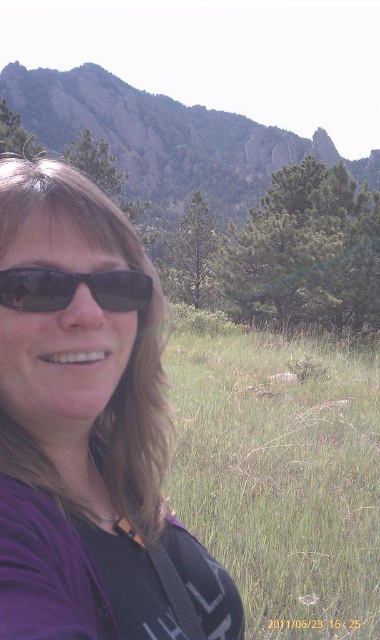
Question: Considering the real-world distances, which object is farthest from the purple matte shirt at left?

Choices:
 (A) rugged rock mountain at upper center
 (B) matte black sunglasses at left
 (C) green grass at center

Answer: (A)

Question: Does purple matte shirt at left appear under rugged rock mountain at upper center?

Choices:
 (A) no
 (B) yes

Answer: (B)

Question: Is purple matte shirt at left above rugged rock mountain at upper center?

Choices:
 (A) yes
 (B) no

Answer: (B)

Question: Which of these objects is positioned closest to the matte black sunglasses at left?

Choices:
 (A) rugged rock mountain at upper center
 (B) purple matte shirt at left

Answer: (B)

Question: Where is purple matte shirt at left located in relation to green grass at center in the image?

Choices:
 (A) left
 (B) right

Answer: (A)

Question: Which of the following is the farthest from the observer?

Choices:
 (A) (14, 285)
 (B) (44, 332)

Answer: (B)